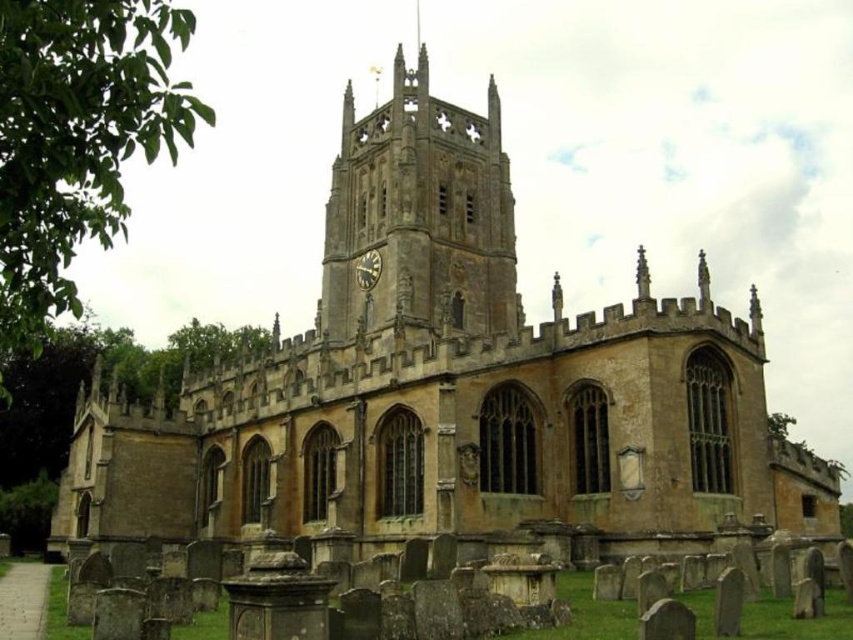
Image resolution: width=853 pixels, height=640 pixels. What do you see at coordinates (421, 212) in the screenshot? I see `golden stone tower at center` at bounding box center [421, 212].

Which of these two, golden stone tower at center or matte gold clock at center, stands shorter?

With less height is matte gold clock at center.

Is point (415, 243) farther from viewer compared to point (358, 269)?

No, it is in front of (358, 269).

Identify the location of golden stone tower at center. The image size is (853, 640). (421, 212).